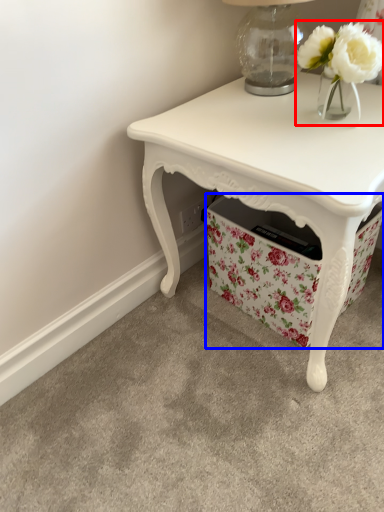
Question: Among these objects, which one is nearest to the camera, floral arrangement (highlighted by a red box) or storage box (highlighted by a blue box)?

Choices:
 (A) floral arrangement
 (B) storage box

Answer: (A)